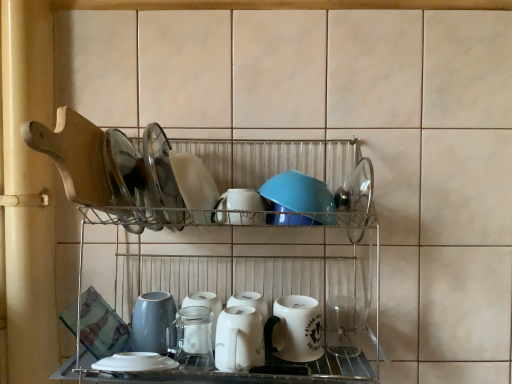
Question: From the image's perspective, relative to white glossy plate at center, arranged as the fourth tableware when ordered from the bottom, is white glossy kettle at center, marked as the 1th tableware in a bottom-to-top arrangement, above or below?

Choices:
 (A) above
 (B) below

Answer: (B)

Question: Is white glossy kettle at center, the fourth tableware positioned from the top, wider or thinner than white glossy plate at center, arranged as the fourth tableware when ordered from the bottom?

Choices:
 (A) thin
 (B) wide

Answer: (A)

Question: Which object is positioned closest to the white glossy mug at lower center?

Choices:
 (A) metallic wire rack at center
 (B) blue matte bowl at center, marked as the 3th tableware in a bottom-to-top arrangement
 (C) white glossy mug at center, which is the 2th tableware in bottom-to-top order
 (D) white glossy plate at center, which appears as the first tableware when viewed from the top
 (E) white glossy kettle at center, the fourth tableware positioned from the top

Answer: (E)

Question: Which object is positioned farthest from the white glossy mug at center, which is the 2th tableware in bottom-to-top order?

Choices:
 (A) white glossy mug at lower center
 (B) white glossy kettle at center, marked as the 1th tableware in a bottom-to-top arrangement
 (C) white glossy plate at center, arranged as the fourth tableware when ordered from the bottom
 (D) metallic wire rack at center
 (E) blue matte bowl at center, marked as the 3th tableware in a bottom-to-top arrangement

Answer: (D)